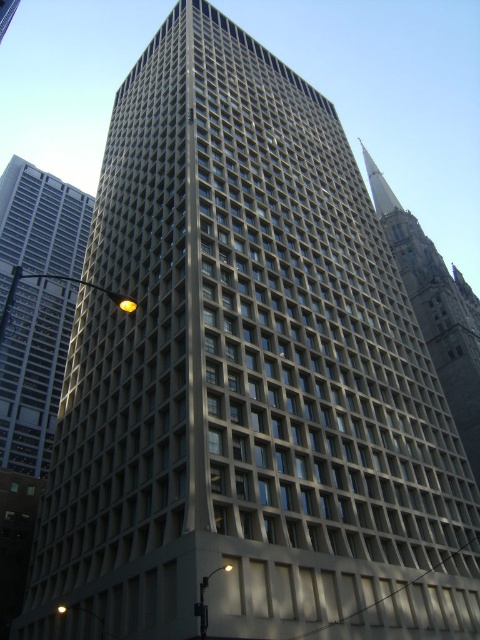
Between silver glass skyscraper at left and smooth gray tower at upper right, which one is positioned lower?

silver glass skyscraper at left

Is point (51, 296) positioned after point (409, 225)?

Yes.

Who is more distant from viewer, (39, 349) or (419, 280)?

Point (39, 349)

This screenshot has width=480, height=640. I want to click on silver glass skyscraper at left, so click(x=34, y=372).